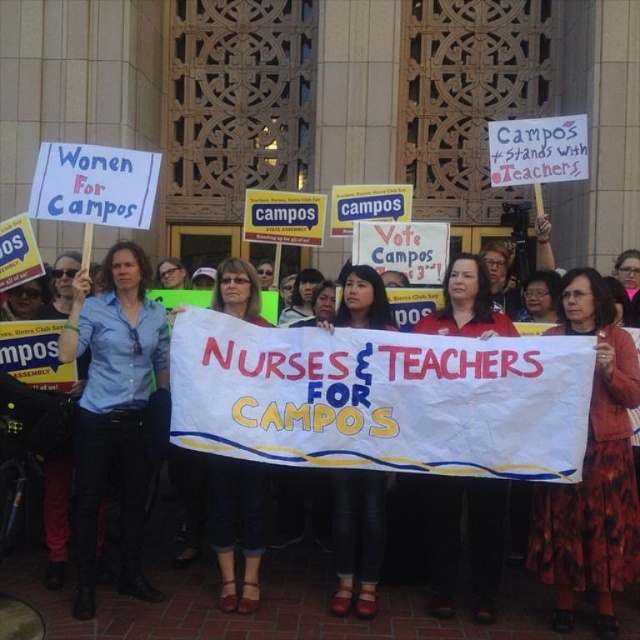
Is blue shirt at center thinner than matte black hair at center?

No, blue shirt at center is not thinner than matte black hair at center.

Where is `blue shirt at center`? The image size is (640, 640). blue shirt at center is located at coordinates (113, 412).

Which of these two, matte red shirt at center or denim pants at center, stands taller?

denim pants at center

From the picture: Is matte red shirt at center above denim pants at center?

Actually, matte red shirt at center is below denim pants at center.

Is point (454, 545) positioned after point (234, 296)?

That is False.

Locate an element on the screen. The height and width of the screenshot is (640, 640). matte red shirt at center is located at coordinates (468, 541).

Is floral dress at center shorter than denim pants at center?

Correct, floral dress at center is not as tall as denim pants at center.

Describe the element at coordinates (593, 472) in the screenshot. I see `floral dress at center` at that location.

Between point (604, 572) and point (257, 490), which one is positioned behind?

The point (257, 490) is behind.

You are a GUI agent. You are given a task and a screenshot of the screen. Output one action in this format:
    pyautogui.click(x=<x>, y=<y>)
    Task: Click on the floral dress at center
    
    Given the screenshot: What is the action you would take?
    pyautogui.click(x=593, y=472)